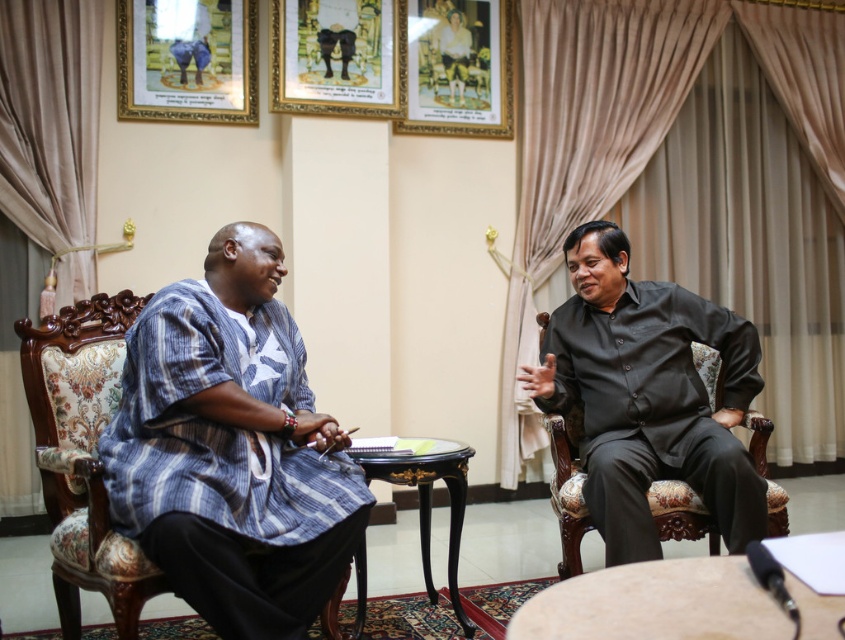
Does blue striped shirt at left have a greater height compared to light brown wooden round table at center?

Indeed, blue striped shirt at left has a greater height compared to light brown wooden round table at center.

Does blue striped shirt at left have a smaller size compared to light brown wooden round table at center?

No.

Between point (260, 528) and point (581, 598), which one is positioned in front?

Point (581, 598) is in front.

The image size is (845, 640). I want to click on blue striped shirt at left, so click(232, 449).

Does point (751, 483) come closer to viewer compared to point (221, 1)?

Yes, it is.

Is black matte shirt at right above matte wooden picture frame at upper left?

Incorrect, black matte shirt at right is not positioned above matte wooden picture frame at upper left.

Locate an element on the screen. The image size is (845, 640). black matte shirt at right is located at coordinates (647, 396).

Does matte wooden picture frame at upper left appear on the right side of wooden framed portrait at upper center?

In fact, matte wooden picture frame at upper left is to the left of wooden framed portrait at upper center.

Looking at this image, does matte wooden picture frame at upper left lie behind wooden framed portrait at upper center?

No, matte wooden picture frame at upper left is in front of wooden framed portrait at upper center.

Where is `matte wooden picture frame at upper left`? Image resolution: width=845 pixels, height=640 pixels. matte wooden picture frame at upper left is located at coordinates (187, 60).